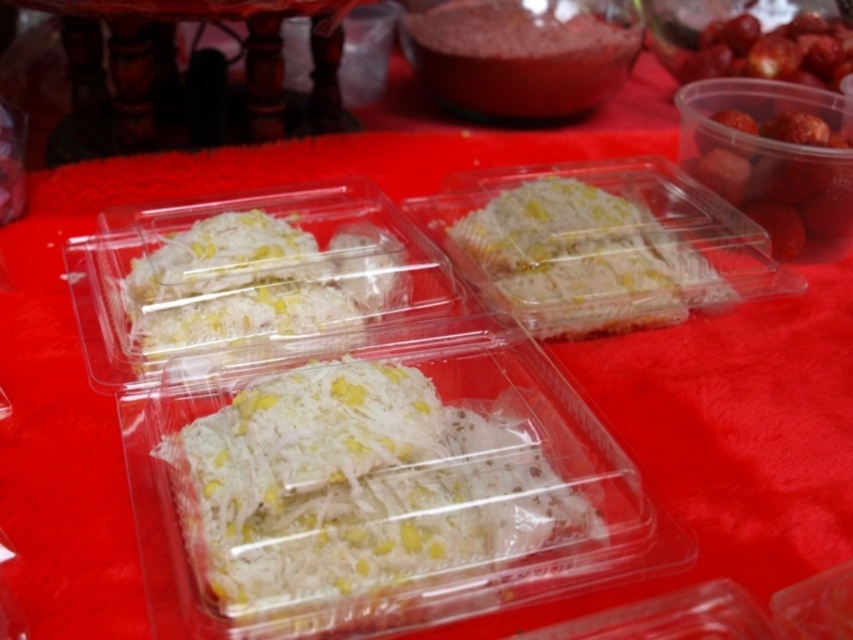
Who is higher up, white translucent cake at center or shiny red strawberries at upper right?

shiny red strawberries at upper right

Who is more distant from viewer, [532,195] or [827,129]?

Positioned behind is point [827,129].

At what (x,y) coordinates should I click in order to perform the action: click on white translucent cake at center. Please return your answer as a coordinate pair (x, y). The height and width of the screenshot is (640, 853). Looking at the image, I should click on (582, 259).

Which is in front, point (506, 48) or point (740, 163)?

Positioned in front is point (740, 163).

Can you confirm if smooth pink powder at center is taller than shiny red strawberries at upper right?

No.

Does point (579, 99) lie behind point (822, 216)?

Yes, point (579, 99) is farther from viewer.

Where is `smooth pink powder at center`? smooth pink powder at center is located at coordinates (523, 54).

Is white translucent cake at center thinner than white translucent rice at center?

Incorrect, white translucent cake at center's width is not less than white translucent rice at center's.

Is point (569, 289) closer to camera compared to point (358, 252)?

Yes.

Between point (540, 310) and point (270, 317), which one is positioned in front?

Point (270, 317) is in front.

Locate an element on the screen. The width and height of the screenshot is (853, 640). white translucent cake at center is located at coordinates (582, 259).